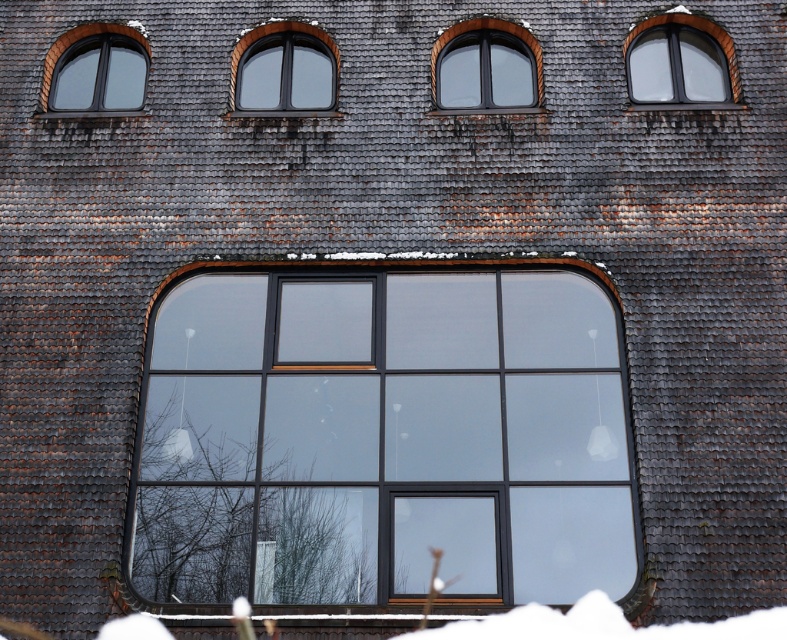
You are standing in front of a building and notice two windows. The first is the matte glass window at upper center, and the second is the matte black window at upper right. Which window is positioned higher up on the building?

The matte black window at upper right is positioned higher up on the building because the matte glass window at upper center is below it.

You are an architect assessing the exterior wall of a building. You notice the matte glass window at upper center and the matte black window at upper right. Which of these two windows has a smaller width?

The matte glass window at upper center has a lesser width compared to the matte black window at upper right, so it is the smaller one in width between the two.

Where is the matte black window at upper right located in the image?

The matte black window at upper right is located at point (678, 60) in the image.